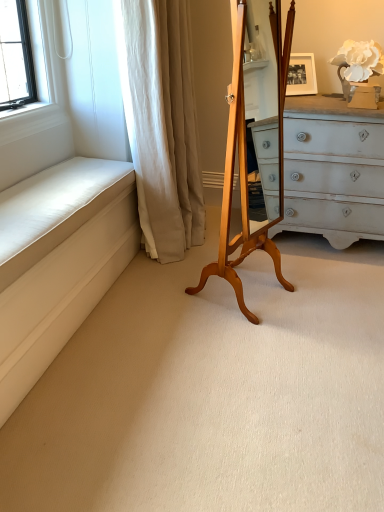
Question: From a real-world perspective, is light brown wood easel at center on white matte flower at upper right?

Choices:
 (A) yes
 (B) no

Answer: (B)

Question: Considering the relative sizes of light brown wood easel at center and white matte flower at upper right in the image provided, is light brown wood easel at center thinner than white matte flower at upper right?

Choices:
 (A) yes
 (B) no

Answer: (B)

Question: Considering the relative positions of light brown wood easel at center and white matte flower at upper right in the image provided, is light brown wood easel at center in front of white matte flower at upper right?

Choices:
 (A) yes
 (B) no

Answer: (A)

Question: Is light brown wood easel at center taller than white matte flower at upper right?

Choices:
 (A) yes
 (B) no

Answer: (A)

Question: From a real-world perspective, is light brown wood easel at center positioned under white matte flower at upper right based on gravity?

Choices:
 (A) yes
 (B) no

Answer: (A)

Question: Relative to white fabric curtain at left, is white matte flower at upper right in front or behind?

Choices:
 (A) front
 (B) behind

Answer: (B)

Question: Do you think white matte flower at upper right is within white fabric curtain at left, or outside of it?

Choices:
 (A) inside
 (B) outside

Answer: (B)

Question: From the image's perspective, is white matte flower at upper right located above or below white fabric curtain at left?

Choices:
 (A) below
 (B) above

Answer: (B)

Question: Is white matte flower at upper right bigger or smaller than white fabric curtain at left?

Choices:
 (A) small
 (B) big

Answer: (A)

Question: Considering their positions, is light brown wood easel at center located in front of or behind white matte flower at upper right?

Choices:
 (A) behind
 (B) front

Answer: (B)

Question: In terms of width, does light brown wood easel at center look wider or thinner when compared to white matte flower at upper right?

Choices:
 (A) wide
 (B) thin

Answer: (A)

Question: Is light brown wood easel at center inside or outside of white matte flower at upper right?

Choices:
 (A) inside
 (B) outside

Answer: (B)

Question: From the image's perspective, is light brown wood easel at center above or below white matte flower at upper right?

Choices:
 (A) above
 (B) below

Answer: (B)

Question: Is white fabric curtain at left to the left or to the right of light brown wood easel at center in the image?

Choices:
 (A) right
 (B) left

Answer: (B)

Question: Considering the positions of point (180, 69) and point (289, 11), is point (180, 69) closer or farther from the camera than point (289, 11)?

Choices:
 (A) closer
 (B) farther

Answer: (A)